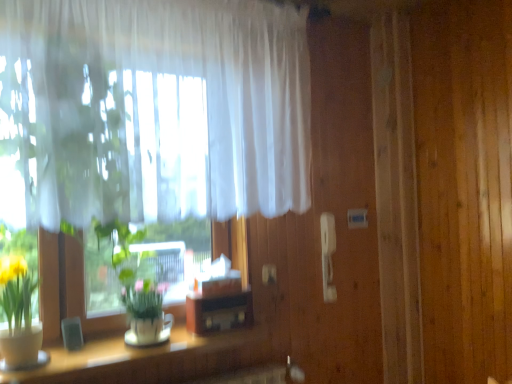
At what (x,y) coordinates should I click in order to perform the action: click on white sheer curtain at upper left. Please return your answer as a coordinate pair (x, y). The height and width of the screenshot is (384, 512). Looking at the image, I should click on (160, 107).

Describe the element at coordinates (160, 107) in the screenshot. This screenshot has height=384, width=512. I see `white sheer curtain at upper left` at that location.

What do you see at coordinates (152, 359) in the screenshot? I see `wooden table at lower left` at bounding box center [152, 359].

This screenshot has width=512, height=384. In order to click on wooden table at lower left in this screenshot , I will do `click(152, 359)`.

What is the approximate width of wooden table at lower left?

wooden table at lower left is 14.56 inches wide.

Measure the distance between wooden table at lower left and camera.

A distance of 1.56 meters exists between wooden table at lower left and camera.

The image size is (512, 384). Find the location of `white sheer curtain at upper left`. white sheer curtain at upper left is located at coordinates (160, 107).

Can you confirm if white sheer curtain at upper left is positioned to the left of wooden table at lower left?

No.

Relative to wooden table at lower left, is white sheer curtain at upper left in front or behind?

white sheer curtain at upper left is in front of wooden table at lower left.

Which is closer, (48, 75) or (170, 360)?

Point (48, 75) is positioned closer to the camera compared to point (170, 360).

From the image's perspective, is white sheer curtain at upper left under wooden table at lower left?

Incorrect, from the image's perspective, white sheer curtain at upper left is higher than wooden table at lower left.

Looking at this image, from a real-world perspective, between white sheer curtain at upper left and wooden table at lower left, who is vertically lower?

wooden table at lower left, from a real-world perspective.

Which object is thinner, white sheer curtain at upper left or wooden table at lower left?

white sheer curtain at upper left is thinner.

Between white sheer curtain at upper left and wooden table at lower left, which one has more height?

With more height is white sheer curtain at upper left.

From the picture: Which of these two, white sheer curtain at upper left or wooden table at lower left, is smaller?

wooden table at lower left.

Is white sheer curtain at upper left completely or partially outside of wooden table at lower left?

Yes.

In the scene shown: Is white sheer curtain at upper left beside wooden table at lower left?

No.

Is white sheer curtain at upper left facing away from wooden table at lower left?

No, wooden table at lower left is not at the back of white sheer curtain at upper left.

At what (x,y) coordinates should I click in order to perform the action: click on table behind the white sheer curtain at upper left. Please return your answer as a coordinate pair (x, y). This screenshot has width=512, height=384. Looking at the image, I should click on (152, 359).

Which object is positioned more to the left, wooden table at lower left or white sheer curtain at upper left?

Positioned to the left is wooden table at lower left.

Is wooden table at lower left further to camera compared to white sheer curtain at upper left?

That is True.

Between point (268, 360) and point (290, 112), which one is positioned in front?

The point (290, 112) is in front.

Looking at this image, from the image's perspective, is wooden table at lower left above or below white sheer curtain at upper left?

Clearly, from the image's perspective, wooden table at lower left is below white sheer curtain at upper left.

From a real-world perspective, is wooden table at lower left under white sheer curtain at upper left?

Indeed, from a real-world perspective, wooden table at lower left is positioned beneath white sheer curtain at upper left.

Considering the relative sizes of wooden table at lower left and white sheer curtain at upper left in the image provided, is wooden table at lower left wider than white sheer curtain at upper left?

Indeed, wooden table at lower left has a greater width compared to white sheer curtain at upper left.

Is wooden table at lower left taller than white sheer curtain at upper left?

In fact, wooden table at lower left may be shorter than white sheer curtain at upper left.

Looking at the image, does wooden table at lower left seem bigger or smaller compared to white sheer curtain at upper left?

In the image, wooden table at lower left appears to be smaller than white sheer curtain at upper left.

Is white sheer curtain at upper left a part of wooden table at lower left?

No, white sheer curtain at upper left is not inside wooden table at lower left.

Are wooden table at lower left and white sheer curtain at upper left located far from each other?

No, there isn't a large distance between wooden table at lower left and white sheer curtain at upper left.

Is white sheer curtain at upper left at the back of wooden table at lower left?

wooden table at lower left does not have its back to white sheer curtain at upper left.

Can you tell me how much wooden table at lower left and white sheer curtain at upper left differ in facing direction?

The angular difference between wooden table at lower left and white sheer curtain at upper left is 1.8 degrees.

At what (x,y) coordinates should I click in order to perform the action: click on curtain located in front of the wooden table at lower left. Please return your answer as a coordinate pair (x, y). Looking at the image, I should click on tap(160, 107).

You are a GUI agent. You are given a task and a screenshot of the screen. Output one action in this format:
    pyautogui.click(x=<x>, y=<y>)
    Task: Click on the curtain above the wooden table at lower left (from a real-world perspective)
    The image size is (512, 384).
    Given the screenshot: What is the action you would take?
    [160, 107]

Locate an element on the screen. The image size is (512, 384). curtain above the wooden table at lower left (from the image's perspective) is located at coordinates (160, 107).